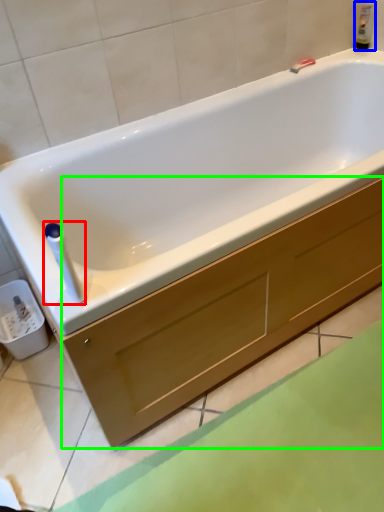
Question: Estimate the real-world distances between objects in this image. Which object is closer to towel bar (highlighted by a red box), bottle (highlighted by a blue box) or drawer (highlighted by a green box)?

Choices:
 (A) bottle
 (B) drawer

Answer: (B)